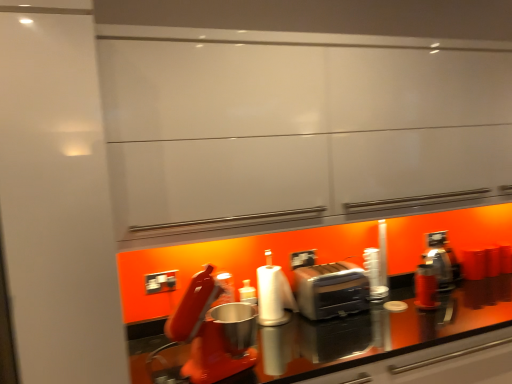
Identify the location of free spot above satin silver toaster at center (from a real-world perspective). The width and height of the screenshot is (512, 384). (331, 269).